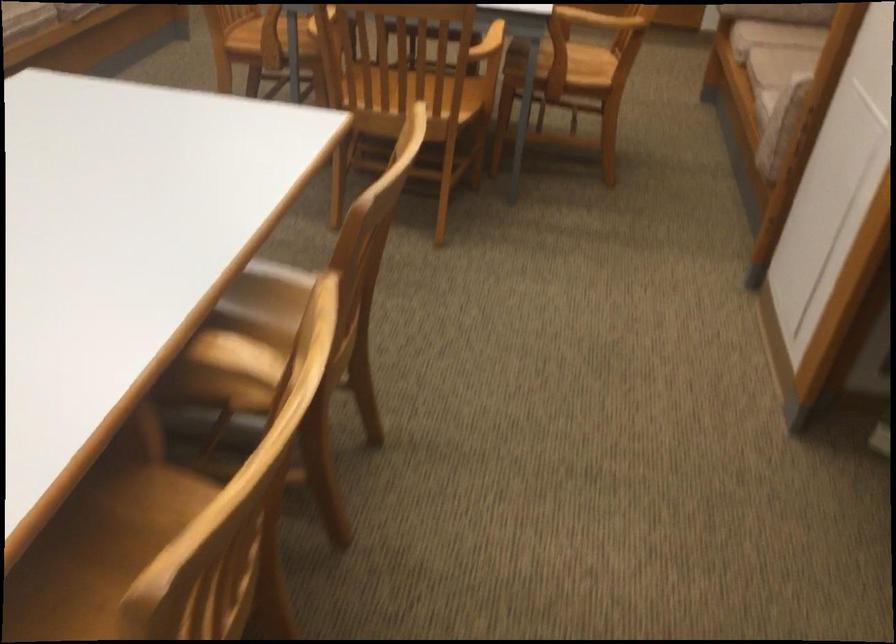
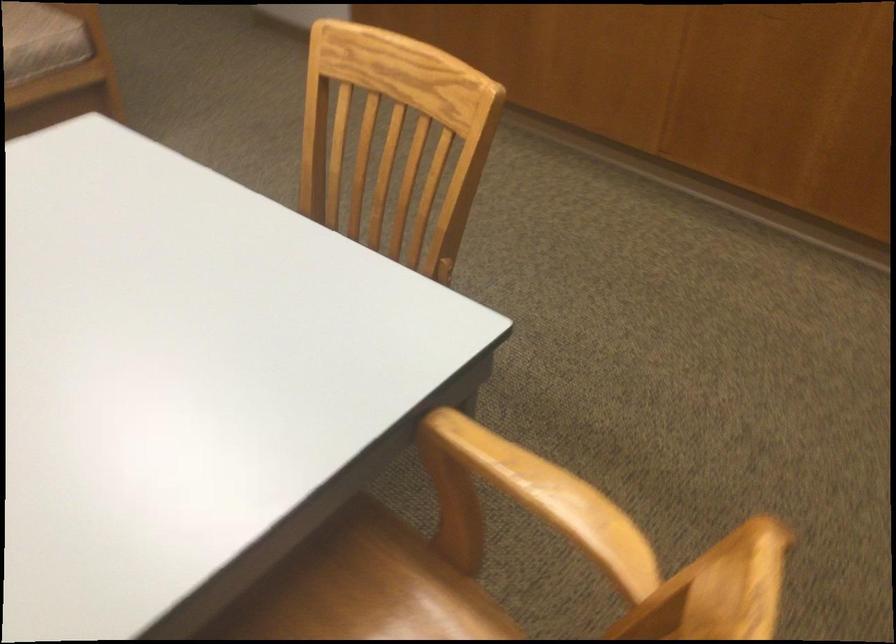
Question: In a continuous first-person perspective shot, in which direction is the camera moving?

Choices:
 (A) Left
 (B) Right
 (C) Forward
 (D) Backward

Answer: (C)